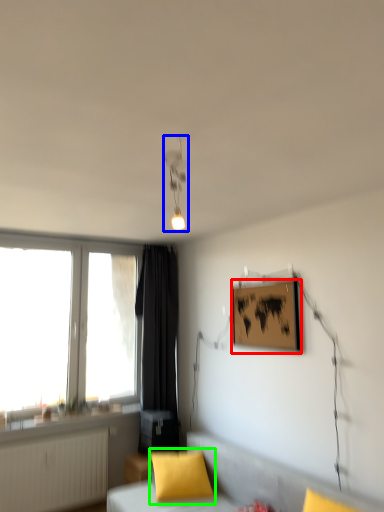
Question: Considering the real-world distances, which object is closest to picture frame (highlighted by a red box)? light fixture (highlighted by a blue box) or pillow (highlighted by a green box).

Choices:
 (A) light fixture
 (B) pillow

Answer: (A)